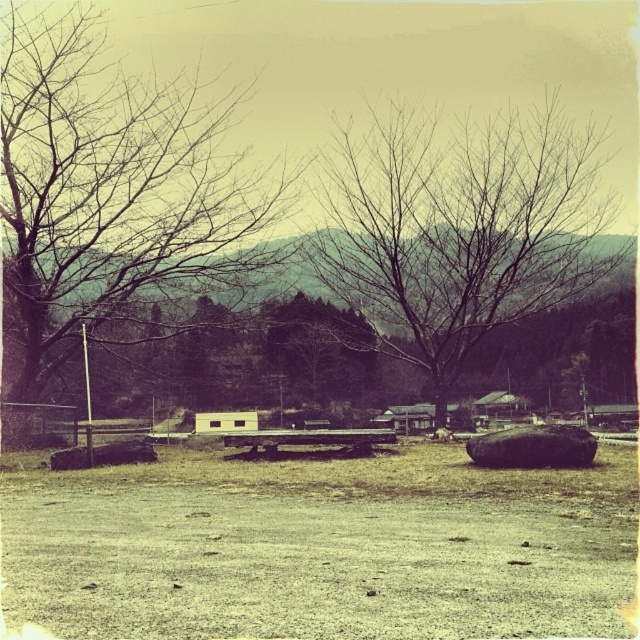
Question: Which point appears farthest from the camera in this image?

Choices:
 (A) click(29, 355)
 (B) click(300, 429)

Answer: (B)

Question: Is bare branches at left in front of smooth brown rock at center?

Choices:
 (A) yes
 (B) no

Answer: (B)

Question: Does smooth brown rock at center appear over wooden picnic table at center?

Choices:
 (A) yes
 (B) no

Answer: (A)

Question: Estimate the real-world distances between objects in this image. Which object is farther from the smooth brown rock at center?

Choices:
 (A) brown dirt field at center
 (B) wooden picnic table at center

Answer: (B)

Question: Is bare branches at left wider than wooden picnic table at center?

Choices:
 (A) no
 (B) yes

Answer: (B)

Question: Among these objects, which one is farthest from the camera?

Choices:
 (A) smooth brown rock at center
 (B) brown dirt field at center
 (C) bare branches at left

Answer: (C)